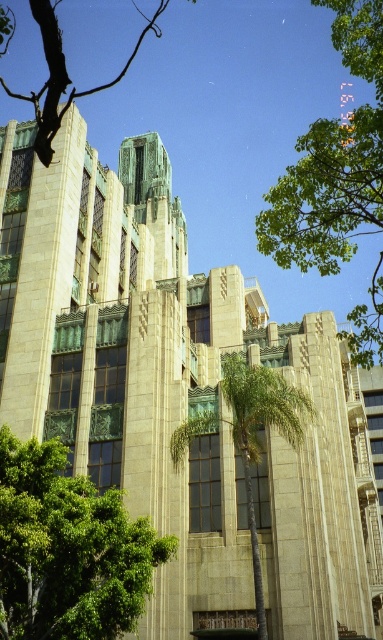
In the scene shown: Who is higher up, green leafy tree at upper right or green leafy palm tree at center?

green leafy tree at upper right

Is green leafy tree at upper right wider than green leafy palm tree at center?

Yes, green leafy tree at upper right is wider than green leafy palm tree at center.

Does point (286, 220) lie behind point (250, 435)?

No, (286, 220) is closer to viewer.

This screenshot has height=640, width=383. Find the location of `green leafy tree at upper right`. green leafy tree at upper right is located at coordinates (332, 161).

Is green leafy tree at lower left below green leafy palm tree at center?

Yes.

Does green leafy tree at lower left appear over green leafy palm tree at center?

Incorrect, green leafy tree at lower left is not positioned above green leafy palm tree at center.

Between point (57, 548) and point (245, 396), which one is positioned in front?

Point (57, 548) is more forward.

This screenshot has height=640, width=383. Identify the location of green leafy tree at lower left. (68, 548).

Based on the photo, between green leafy tree at lower left and green leafy tree at upper right, which one is positioned higher?

Positioned higher is green leafy tree at upper right.

At what (x,y) coordinates should I click in order to perform the action: click on green leafy tree at lower left. Please return your answer as a coordinate pair (x, y). Looking at the image, I should click on (68, 548).

Between point (24, 545) and point (371, 298), which one is positioned in front?

Point (24, 545) is in front.

This screenshot has width=383, height=640. I want to click on green leafy tree at lower left, so click(68, 548).